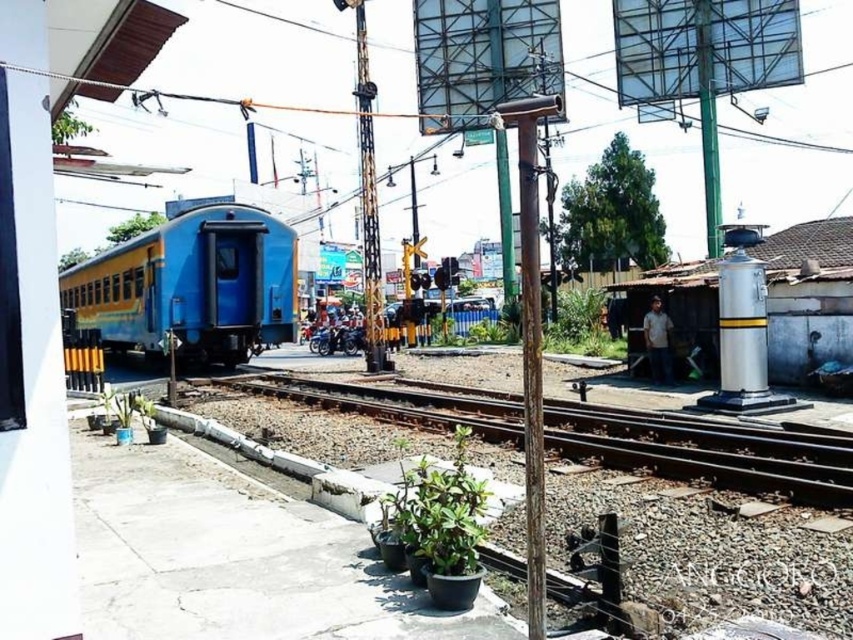
You are standing at point (363, 60) and want to walk to point (274, 236). Which direction should you move in relation to the railway tracks?

You should move behind the railway tracks to reach point (274, 236) because it is located behind point (363, 60).

In the scene shown: You are a photographer trying to capture a photo of the blue matte train at left and the white shirt at right. Which object should you zoom in on to ensure both are in frame without moving your position?

The blue matte train at left is wider than the white shirt at right, so you should zoom in on the blue matte train at left to ensure both are in frame without moving your position.